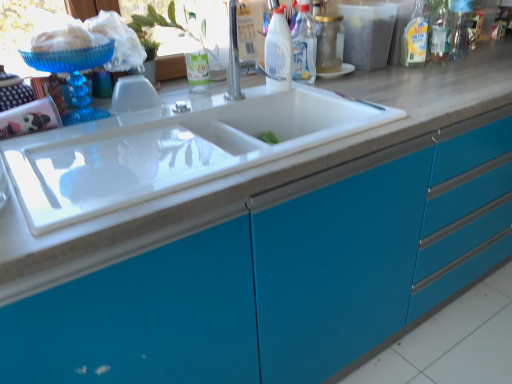
Where is `vacant space to the right of white glossy bottle at upper center, the 4th bottle from the right`? vacant space to the right of white glossy bottle at upper center, the 4th bottle from the right is located at coordinates (330, 89).